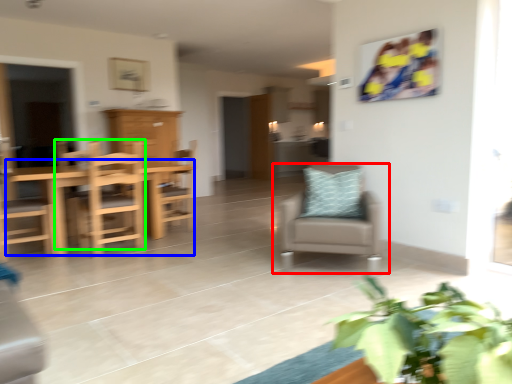
Question: Considering the real-world distances, which object is farthest from chair (highlighted by a red box)? table (highlighted by a blue box) or chair (highlighted by a green box)?

Choices:
 (A) table
 (B) chair

Answer: (A)